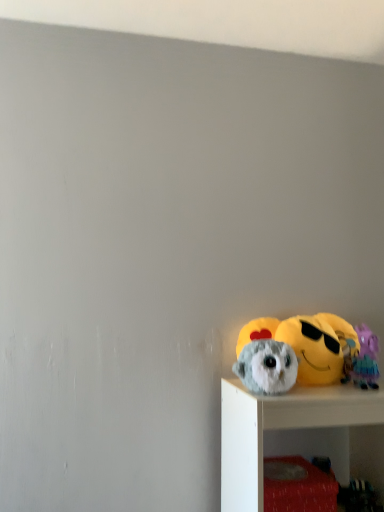
What do you see at coordinates (366, 359) in the screenshot? The height and width of the screenshot is (512, 384). I see `purple plush toy at right, the first toy positioned from the right` at bounding box center [366, 359].

This screenshot has width=384, height=512. Find the location of `fluffy gray owl at lower right, the second toy when ordered from right to left`. fluffy gray owl at lower right, the second toy when ordered from right to left is located at coordinates (320, 346).

Is fluffy gray plush at lower right, the third toy positioned from the right, inside fluffy gray owl at lower right, the second toy when ordered from right to left?

No.

Locate an element on the screen. This screenshot has width=384, height=512. the 2nd toy below the fluffy gray owl at lower right, which is counted as the second toy, starting from the left (from a real-world perspective) is located at coordinates (267, 367).

Which of these two, fluffy gray owl at lower right, the second toy when ordered from right to left, or fluffy gray plush at lower right, the third toy positioned from the right, is bigger?

fluffy gray owl at lower right, the second toy when ordered from right to left.

Is fluffy gray owl at lower right, the second toy when ordered from right to left, taller or shorter than fluffy gray plush at lower right, the third toy positioned from the right?

Considering their sizes, fluffy gray owl at lower right, the second toy when ordered from right to left, has more height than fluffy gray plush at lower right, the third toy positioned from the right.

Is fluffy gray plush at lower right, positioned as the first toy in left-to-right order, turned away from fluffy gray owl at lower right, which is counted as the second toy, starting from the left?

No.

Does fluffy gray plush at lower right, positioned as the first toy in left-to-right order, contain fluffy gray owl at lower right, which is counted as the second toy, starting from the left?

No.

Between fluffy gray plush at lower right, positioned as the first toy in left-to-right order, and fluffy gray owl at lower right, which is counted as the second toy, starting from the left, which one has larger width?

fluffy gray plush at lower right, positioned as the first toy in left-to-right order.

Based on the photo, from the image's perspective, would you say fluffy gray plush at lower right, the third toy positioned from the right, is positioned over fluffy gray owl at lower right, the second toy when ordered from right to left?

Incorrect, from the image's perspective, fluffy gray plush at lower right, the third toy positioned from the right, is lower than fluffy gray owl at lower right, the second toy when ordered from right to left.

Starting from the purple plush toy at right, the first toy positioned from the right, which toy is the 1st one to the left? Please provide its 2D coordinates.

[(320, 346)]

Looking at this image, from a real-world perspective, between fluffy gray owl at lower right, which is counted as the second toy, starting from the left, and purple plush toy at right, the first toy positioned from the right, who is vertically lower?

In real-world perspective, purple plush toy at right, the first toy positioned from the right, is lower.

In the image, is fluffy gray owl at lower right, the second toy when ordered from right to left, positioned in front of or behind purple plush toy at right, the first toy positioned from the right?

In the image, fluffy gray owl at lower right, the second toy when ordered from right to left, appears behind purple plush toy at right, the first toy positioned from the right.

Would you consider fluffy gray owl at lower right, which is counted as the second toy, starting from the left, to be distant from purple plush toy at right, the first toy positioned from the right?

No.

Does point (284, 372) lie behind point (368, 347)?

No, it is in front of (368, 347).

From the image's perspective, would you say fluffy gray plush at lower right, the third toy positioned from the right, is positioned over purple plush toy at right, which is the third toy in left-to-right order?

No, from the image's perspective, fluffy gray plush at lower right, the third toy positioned from the right, is not over purple plush toy at right, which is the third toy in left-to-right order.

Considering the relative sizes of fluffy gray plush at lower right, positioned as the first toy in left-to-right order, and purple plush toy at right, the first toy positioned from the right, in the image provided, is fluffy gray plush at lower right, positioned as the first toy in left-to-right order, taller than purple plush toy at right, the first toy positioned from the right,?

In fact, fluffy gray plush at lower right, positioned as the first toy in left-to-right order, may be shorter than purple plush toy at right, the first toy positioned from the right.

Is fluffy gray plush at lower right, the third toy positioned from the right, positioned far away from purple plush toy at right, which is the third toy in left-to-right order?

Actually, fluffy gray plush at lower right, the third toy positioned from the right, and purple plush toy at right, which is the third toy in left-to-right order, are a little close together.

Where is `toy that is on the right side of fluffy gray owl at lower right, the second toy when ordered from right to left`? The height and width of the screenshot is (512, 384). toy that is on the right side of fluffy gray owl at lower right, the second toy when ordered from right to left is located at coordinates (366, 359).

Is purple plush toy at right, the first toy positioned from the right, taller or shorter than fluffy gray owl at lower right, the second toy when ordered from right to left?

Clearly, purple plush toy at right, the first toy positioned from the right, is shorter compared to fluffy gray owl at lower right, the second toy when ordered from right to left.

Is purple plush toy at right, which is the third toy in left-to-right order, positioned far away from fluffy gray owl at lower right, which is counted as the second toy, starting from the left?

That's not correct — purple plush toy at right, which is the third toy in left-to-right order, is a little close to fluffy gray owl at lower right, which is counted as the second toy, starting from the left.

Is purple plush toy at right, which is the third toy in left-to-right order, not near fluffy gray plush at lower right, the third toy positioned from the right?

No, purple plush toy at right, which is the third toy in left-to-right order, is not far from fluffy gray plush at lower right, the third toy positioned from the right.

Considering the sizes of objects purple plush toy at right, the first toy positioned from the right, and fluffy gray plush at lower right, the third toy positioned from the right, in the image provided, who is taller, purple plush toy at right, the first toy positioned from the right, or fluffy gray plush at lower right, the third toy positioned from the right,?

purple plush toy at right, the first toy positioned from the right, is taller.

Identify the location of toy that is the 1st object located above the fluffy gray plush at lower right, the third toy positioned from the right (from the image's perspective). (366, 359).

Considering the relative sizes of purple plush toy at right, the first toy positioned from the right, and fluffy gray plush at lower right, the third toy positioned from the right, in the image provided, is purple plush toy at right, the first toy positioned from the right, thinner than fluffy gray plush at lower right, the third toy positioned from the right,?

Incorrect, the width of purple plush toy at right, the first toy positioned from the right, is not less than that of fluffy gray plush at lower right, the third toy positioned from the right.

Identify the location of the 2nd toy below the fluffy gray owl at lower right, which is counted as the second toy, starting from the left (from a real-world perspective). 267,367.

From the fluffy gray plush at lower right, the third toy positioned from the right, count 2nd toys backward and point to it. Please provide its 2D coordinates.

[(320, 346)]

Looking at the image, which one is located closer to fluffy gray owl at lower right, which is counted as the second toy, starting from the left, purple plush toy at right, which is the third toy in left-to-right order, or fluffy gray plush at lower right, the third toy positioned from the right?

purple plush toy at right, which is the third toy in left-to-right order, is closer to fluffy gray owl at lower right, which is counted as the second toy, starting from the left.

Looking at the image, which one is located closer to purple plush toy at right, the first toy positioned from the right, fluffy gray owl at lower right, which is counted as the second toy, starting from the left, or fluffy gray plush at lower right, the third toy positioned from the right?

fluffy gray owl at lower right, which is counted as the second toy, starting from the left, is closer to purple plush toy at right, the first toy positioned from the right.

Looking at the image, which one is located further to purple plush toy at right, which is the third toy in left-to-right order, fluffy gray plush at lower right, the third toy positioned from the right, or fluffy gray owl at lower right, which is counted as the second toy, starting from the left?

The object further to purple plush toy at right, which is the third toy in left-to-right order, is fluffy gray plush at lower right, the third toy positioned from the right.

Which object lies further to the anchor point fluffy gray owl at lower right, the second toy when ordered from right to left, fluffy gray plush at lower right, positioned as the first toy in left-to-right order, or purple plush toy at right, the first toy positioned from the right?

Among the two, fluffy gray plush at lower right, positioned as the first toy in left-to-right order, is located further to fluffy gray owl at lower right, the second toy when ordered from right to left.

Considering their positions, is fluffy gray owl at lower right, which is counted as the second toy, starting from the left, positioned closer to fluffy gray plush at lower right, positioned as the first toy in left-to-right order, than purple plush toy at right, the first toy positioned from the right?

fluffy gray owl at lower right, which is counted as the second toy, starting from the left.

Considering their positions, is purple plush toy at right, which is the third toy in left-to-right order, positioned closer to fluffy gray plush at lower right, positioned as the first toy in left-to-right order, than fluffy gray owl at lower right, which is counted as the second toy, starting from the left?

fluffy gray owl at lower right, which is counted as the second toy, starting from the left.

Locate an element on the screen. toy situated between fluffy gray plush at lower right, positioned as the first toy in left-to-right order, and purple plush toy at right, which is the third toy in left-to-right order, from left to right is located at coordinates (320, 346).